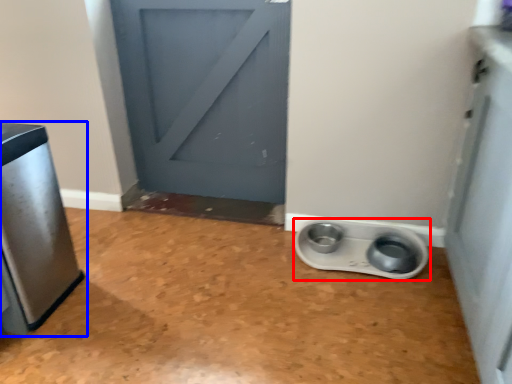
Question: Which of the following is the closest to the observer, appliance (highlighted by a red box) or home appliance (highlighted by a blue box)?

Choices:
 (A) appliance
 (B) home appliance

Answer: (B)